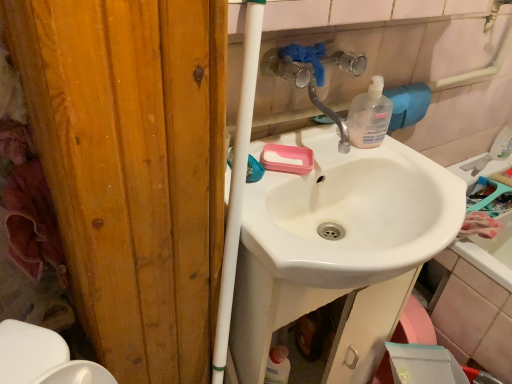
Identify the location of clear plastic faucet at upper center. Image resolution: width=512 pixels, height=384 pixels. (313, 74).

Describe the element at coordinates (369, 116) in the screenshot. I see `translucent plastic soap dispenser at upper right` at that location.

What do you see at coordinates (287, 159) in the screenshot?
I see `pink matte soap at center` at bounding box center [287, 159].

What is the approximate width of pink matte soap at center?

pink matte soap at center is 4.70 inches wide.

The height and width of the screenshot is (384, 512). Find the location of `clear plastic faucet at upper center`. clear plastic faucet at upper center is located at coordinates (313, 74).

Choose the correct answer: Is white glossy sink at center inside translucent plastic soap dispenser at upper right or outside it?

white glossy sink at center cannot be found inside translucent plastic soap dispenser at upper right.

Could you tell me if white glossy sink at center is turned towards translucent plastic soap dispenser at upper right?

No, white glossy sink at center is not aimed at translucent plastic soap dispenser at upper right.

Which is more to the left, white glossy sink at center or translucent plastic soap dispenser at upper right?

Positioned to the left is translucent plastic soap dispenser at upper right.

The width and height of the screenshot is (512, 384). I want to click on bottle lying in front of the white glossy sink at center, so click(369, 116).

Could you tell me if white glossy sink at center is turned towards pink matte soap at center?

No, white glossy sink at center is not aimed at pink matte soap at center.

This screenshot has height=384, width=512. Find the location of `soap located in front of the white glossy sink at center`. soap located in front of the white glossy sink at center is located at coordinates (287, 159).

From a real-world perspective, is white glossy sink at center under pink matte soap at center?

Yes, from a real-world perspective, white glossy sink at center is beneath pink matte soap at center.

Can you confirm if white glossy sink at center is smaller than pink matte soap at center?

No, white glossy sink at center is not smaller than pink matte soap at center.

Is there a large distance between pink matte soap at center and white glossy sink at center?

Actually, pink matte soap at center and white glossy sink at center are a little close together.

Based on the photo, considering the relative sizes of pink matte soap at center and white glossy sink at center in the image provided, is pink matte soap at center wider than white glossy sink at center?

No.

Does point (310, 171) lie behind point (445, 347)?

That is False.

Which object is positioned more to the right, translucent plastic soap dispenser at upper right or white glossy sink at center?

From the viewer's perspective, white glossy sink at center appears more on the right side.

Could you tell me if translucent plastic soap dispenser at upper right is turned towards white glossy sink at center?

No, translucent plastic soap dispenser at upper right is not oriented towards white glossy sink at center.

From their relative heights in the image, would you say translucent plastic soap dispenser at upper right is taller or shorter than white glossy sink at center?

Considering their sizes, translucent plastic soap dispenser at upper right has less height than white glossy sink at center.

From a real-world perspective, who is located lower, translucent plastic soap dispenser at upper right or white glossy sink at center?

In real-world perspective, white glossy sink at center is lower.

Could you tell me if clear plastic faucet at upper center is facing pink matte soap at center?

No, clear plastic faucet at upper center is not oriented towards pink matte soap at center.

Consider the image. Is clear plastic faucet at upper center positioned before pink matte soap at center?

Yes, it is.

Who is bigger, clear plastic faucet at upper center or pink matte soap at center?

With larger size is clear plastic faucet at upper center.

You are a GUI agent. You are given a task and a screenshot of the screen. Output one action in this format:
    pyautogui.click(x=<x>, y=<y>)
    Task: Click on the plumbing fixture above the pink matte soap at center (from the image's perspective)
    Image resolution: width=512 pixels, height=384 pixels.
    Given the screenshot: What is the action you would take?
    pyautogui.click(x=313, y=74)

Based on the photo, is pink matte soap at center bigger than clear plastic faucet at upper center?

No, pink matte soap at center is not bigger than clear plastic faucet at upper center.

Could you tell me if pink matte soap at center is turned towards clear plastic faucet at upper center?

No, pink matte soap at center is not turned towards clear plastic faucet at upper center.

Is pink matte soap at center in front of or behind clear plastic faucet at upper center in the image?

Visually, pink matte soap at center is located behind clear plastic faucet at upper center.

Consider the image. Are pink matte soap at center and clear plastic faucet at upper center far apart?

No, pink matte soap at center is not far away from clear plastic faucet at upper center.

Does clear plastic faucet at upper center lie behind translucent plastic soap dispenser at upper right?

No, clear plastic faucet at upper center is closer to the camera.

Can you tell me how much clear plastic faucet at upper center and translucent plastic soap dispenser at upper right differ in facing direction?

There is a 1.57-degree angle between the facing directions of clear plastic faucet at upper center and translucent plastic soap dispenser at upper right.

What are the coordinates of `bottle located below the clear plastic faucet at upper center (from the image's perspective)` in the screenshot? It's located at (369, 116).

Which is in front, point (310, 56) or point (373, 76)?

The point (310, 56) is closer to the camera.

The height and width of the screenshot is (384, 512). What are the coordinates of `bottle that appears in front of the white glossy sink at center` in the screenshot? It's located at (369, 116).

I want to click on bath on the right side of pink matte soap at center, so click(477, 301).

Looking at the image, which one is located closer to translucent plastic soap dispenser at upper right, white glossy sink at center or pink matte soap at center?

Based on the image, pink matte soap at center appears to be nearer to translucent plastic soap dispenser at upper right.

Based on their spatial positions, is clear plastic faucet at upper center or pink matte soap at center further from translucent plastic soap dispenser at upper right?

pink matte soap at center.

Based on their spatial positions, is pink matte soap at center or white glossy sink at center closer to clear plastic faucet at upper center?

pink matte soap at center.

Based on their spatial positions, is translucent plastic soap dispenser at upper right or pink matte soap at center closer to white glossy sink at center?

Among the two, translucent plastic soap dispenser at upper right is located nearer to white glossy sink at center.

Considering their positions, is pink matte soap at center positioned closer to translucent plastic soap dispenser at upper right than clear plastic faucet at upper center?

clear plastic faucet at upper center lies closer to translucent plastic soap dispenser at upper right than the other object.

Considering their positions, is translucent plastic soap dispenser at upper right positioned further to white glossy sink at center than clear plastic faucet at upper center?

clear plastic faucet at upper center is further to white glossy sink at center.

From the image, which object appears to be nearer to clear plastic faucet at upper center, translucent plastic soap dispenser at upper right or pink matte soap at center?

The object closer to clear plastic faucet at upper center is translucent plastic soap dispenser at upper right.

From the image, which object appears to be farther from pink matte soap at center, clear plastic faucet at upper center or translucent plastic soap dispenser at upper right?

Based on the image, translucent plastic soap dispenser at upper right appears to be further to pink matte soap at center.

What are the coordinates of `bottle between pink matte soap at center and white glossy sink at center from left to right` in the screenshot? It's located at (369, 116).

Locate an element on the screen. The height and width of the screenshot is (384, 512). soap between clear plastic faucet at upper center and translucent plastic soap dispenser at upper right from front to back is located at coordinates (287, 159).

The image size is (512, 384). I want to click on bottle situated between clear plastic faucet at upper center and white glossy sink at center from left to right, so click(369, 116).

This screenshot has width=512, height=384. What are the coordinates of `plumbing fixture situated between pink matte soap at center and white glossy sink at center from left to right` in the screenshot? It's located at (313, 74).